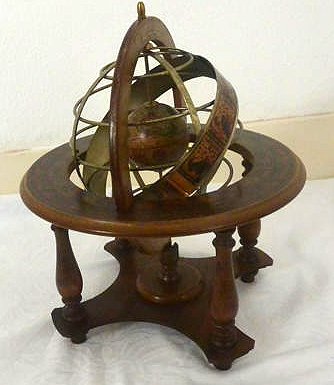
Image resolution: width=334 pixels, height=385 pixels. What are the coordinates of `linen` in the screenshot? It's located at tap(145, 351).